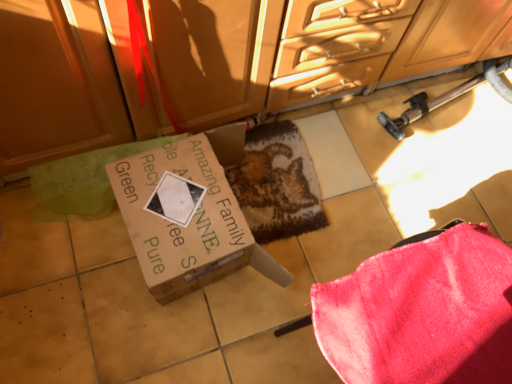
Question: From a real-world perspective, relative to brown cardboard box at center, is matte wood cabinetry at upper center vertically above or below?

Choices:
 (A) below
 (B) above

Answer: (B)

Question: From the image's perspective, is matte wood cabinetry at upper center located above or below brown cardboard box at center?

Choices:
 (A) below
 (B) above

Answer: (B)

Question: Based on their relative distances, which object is nearer to the velvety pink blanket at lower right?

Choices:
 (A) brown cardboard box at center
 (B) matte wood cabinetry at upper center
 (C) textured brown mat at center

Answer: (A)

Question: Based on their relative distances, which object is nearer to the textured brown mat at center?

Choices:
 (A) matte wood cabinetry at upper center
 (B) velvety pink blanket at lower right
 (C) brown cardboard box at center

Answer: (C)